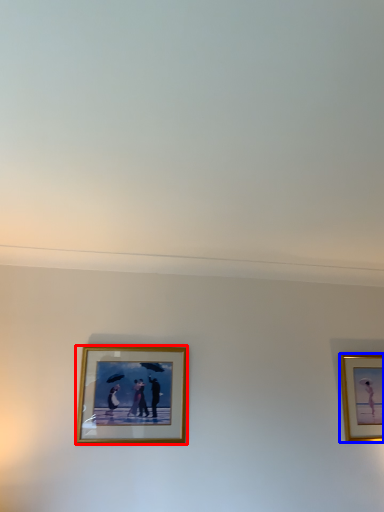
Question: Which object appears farthest to the camera in this image, picture frame (highlighted by a red box) or picture frame (highlighted by a blue box)?

Choices:
 (A) picture frame
 (B) picture frame

Answer: (B)